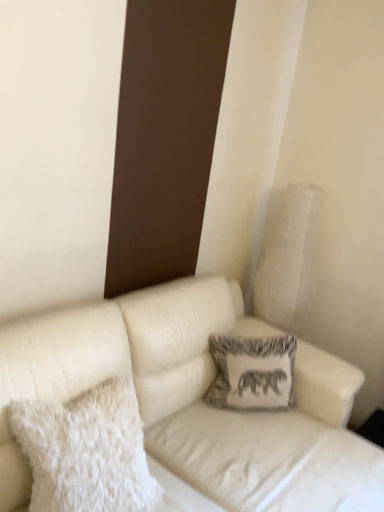
The height and width of the screenshot is (512, 384). What do you see at coordinates (252, 372) in the screenshot?
I see `printed fabric pillow at center, the second pillow from the right` at bounding box center [252, 372].

The height and width of the screenshot is (512, 384). Describe the element at coordinates (195, 400) in the screenshot. I see `white leather couch at center` at that location.

The height and width of the screenshot is (512, 384). In order to click on white leather couch at center in this screenshot , I will do `click(195, 400)`.

Locate an element on the screen. The image size is (384, 512). white textured pillow at upper right, the 3th pillow positioned from the left is located at coordinates (290, 261).

I want to click on printed fabric pillow at center, the 2th pillow positioned from the back, so click(x=252, y=372).

Is white textured pillow at upper right, acting as the 3th pillow starting from the front, facing towards white leather couch at center?

No, white textured pillow at upper right, acting as the 3th pillow starting from the front, is not oriented towards white leather couch at center.

Considering the sizes of white textured pillow at upper right, acting as the first pillow starting from the right, and white leather couch at center in the image, is white textured pillow at upper right, acting as the first pillow starting from the right, wider or thinner than white leather couch at center?

In the image, white textured pillow at upper right, acting as the first pillow starting from the right, appears to be more narrow than white leather couch at center.

From a real-world perspective, is white textured pillow at upper right, acting as the first pillow starting from the right, located higher than white leather couch at center?

Yes, from a real-world perspective, white textured pillow at upper right, acting as the first pillow starting from the right, is above white leather couch at center.

Which object is positioned more to the right, white textured pillow at upper right, the 3th pillow positioned from the left, or white leather couch at center?

Positioned to the right is white textured pillow at upper right, the 3th pillow positioned from the left.

Is white fluffy pillow at left, marked as the third pillow in a right-to-left arrangement, not inside white leather couch at center?

white fluffy pillow at left, marked as the third pillow in a right-to-left arrangement, lies outside white leather couch at center's area.

From the image's perspective, which object appears higher, white fluffy pillow at left, which is counted as the first pillow, starting from the left, or white leather couch at center?

white fluffy pillow at left, which is counted as the first pillow, starting from the left, from the image's perspective.

Between white fluffy pillow at left, which is counted as the first pillow, starting from the left, and white leather couch at center, which one has larger width?

Wider between the two is white leather couch at center.

From their relative heights in the image, would you say white fluffy pillow at left, which is counted as the first pillow, starting from the left, is taller or shorter than white leather couch at center?

white fluffy pillow at left, which is counted as the first pillow, starting from the left, is shorter than white leather couch at center.

Is printed fabric pillow at center, placed as the second pillow when sorted from left to right, wider or thinner than white fluffy pillow at left, which is the third pillow in back-to-front order?

Considering their sizes, printed fabric pillow at center, placed as the second pillow when sorted from left to right, looks slimmer than white fluffy pillow at left, which is the third pillow in back-to-front order.

From the image's perspective, is printed fabric pillow at center, placed as the second pillow when sorted from left to right, positioned above or below white fluffy pillow at left, which is counted as the first pillow, starting from the left?

Based on their image positions, printed fabric pillow at center, placed as the second pillow when sorted from left to right, is located above white fluffy pillow at left, which is counted as the first pillow, starting from the left.

Considering the relative positions of printed fabric pillow at center, placed as the second pillow when sorted from left to right, and white fluffy pillow at left, which is counted as the first pillow, starting from the left, in the image provided, is printed fabric pillow at center, placed as the second pillow when sorted from left to right, to the left or to the right of white fluffy pillow at left, which is counted as the first pillow, starting from the left,?

printed fabric pillow at center, placed as the second pillow when sorted from left to right, is positioned on white fluffy pillow at left, which is counted as the first pillow, starting from the left,'s right side.

Is white textured pillow at upper right, the 3th pillow positioned from the left, behind white fluffy pillow at left, which is the third pillow in back-to-front order?

Yes, white textured pillow at upper right, the 3th pillow positioned from the left, is further from the viewer.

Is point (276, 232) less distant than point (64, 498)?

No, it is not.

From the image's perspective, relative to white fluffy pillow at left, marked as the third pillow in a right-to-left arrangement, is white textured pillow at upper right, acting as the first pillow starting from the right, above or below?

Clearly, from the image's perspective, white textured pillow at upper right, acting as the first pillow starting from the right, is above white fluffy pillow at left, marked as the third pillow in a right-to-left arrangement.

Based on their sizes in the image, would you say white textured pillow at upper right, acting as the 3th pillow starting from the front, is bigger or smaller than white fluffy pillow at left, marked as the third pillow in a right-to-left arrangement?

In the image, white textured pillow at upper right, acting as the 3th pillow starting from the front, appears to be larger than white fluffy pillow at left, marked as the third pillow in a right-to-left arrangement.

Considering the relative sizes of white leather couch at center and printed fabric pillow at center, the 2th pillow viewed from the front, in the image provided, is white leather couch at center bigger than printed fabric pillow at center, the 2th pillow viewed from the front,?

Yes.

Does point (276, 486) lie behind point (235, 380)?

No, it is in front of (235, 380).

Is white leather couch at center at the left side of printed fabric pillow at center, placed as the second pillow when sorted from left to right?

No.

Is white leather couch at center further to camera compared to printed fabric pillow at center, the second pillow from the right?

No, white leather couch at center is in front of printed fabric pillow at center, the second pillow from the right.

Visually, is white fluffy pillow at left, which is counted as the first pillow, starting from the left, positioned to the left or to the right of printed fabric pillow at center, the 2th pillow positioned from the back?

white fluffy pillow at left, which is counted as the first pillow, starting from the left, is to the left of printed fabric pillow at center, the 2th pillow positioned from the back.

Which point is more forward, (112,493) or (247,341)?

Positioned in front is point (112,493).

Is white fluffy pillow at left, marked as the third pillow in a right-to-left arrangement, further to camera compared to printed fabric pillow at center, the second pillow from the right?

No.

From a real-world perspective, which object stands above the other?

In real-world perspective, white fluffy pillow at left, which is the third pillow in back-to-front order, is above.

Between white textured pillow at upper right, acting as the 3th pillow starting from the front, and printed fabric pillow at center, the 2th pillow viewed from the front, which one has larger width?

Wider between the two is white textured pillow at upper right, acting as the 3th pillow starting from the front.

Considering the relative sizes of white textured pillow at upper right, the 3th pillow positioned from the left, and printed fabric pillow at center, placed as the second pillow when sorted from left to right, in the image provided, is white textured pillow at upper right, the 3th pillow positioned from the left, shorter than printed fabric pillow at center, placed as the second pillow when sorted from left to right,?

Incorrect, the height of white textured pillow at upper right, the 3th pillow positioned from the left, does not fall short of that of printed fabric pillow at center, placed as the second pillow when sorted from left to right.

Is white textured pillow at upper right, acting as the 3th pillow starting from the front, smaller than printed fabric pillow at center, the second pillow from the right?

Incorrect, white textured pillow at upper right, acting as the 3th pillow starting from the front, is not smaller in size than printed fabric pillow at center, the second pillow from the right.

Locate an element on the screen. pillow that is on the right side of printed fabric pillow at center, placed as the second pillow when sorted from left to right is located at coordinates (290, 261).

Where is `studio couch that appears below the white textured pillow at upper right, the 3th pillow positioned from the left (from a real-world perspective)`? The height and width of the screenshot is (512, 384). studio couch that appears below the white textured pillow at upper right, the 3th pillow positioned from the left (from a real-world perspective) is located at coordinates (195, 400).

Identify the location of the 1st pillow positioned above the white leather couch at center (from the image's perspective). Image resolution: width=384 pixels, height=512 pixels. (87, 451).

Considering their positions, is white leather couch at center positioned closer to white textured pillow at upper right, acting as the 3th pillow starting from the front, than white fluffy pillow at left, which is counted as the first pillow, starting from the left?

Based on the image, white leather couch at center appears to be nearer to white textured pillow at upper right, acting as the 3th pillow starting from the front.

Looking at this image, considering their positions, is white textured pillow at upper right, the 1th pillow positioned from the back, positioned further to white leather couch at center than white fluffy pillow at left, which is counted as the first pillow, starting from the left?

white textured pillow at upper right, the 1th pillow positioned from the back, is positioned further to the anchor white leather couch at center.

Consider the image. When comparing their distances from white leather couch at center, does printed fabric pillow at center, the 2th pillow viewed from the front, or white textured pillow at upper right, the 3th pillow positioned from the left, seem further?

Among the two, white textured pillow at upper right, the 3th pillow positioned from the left, is located further to white leather couch at center.

Considering their positions, is white leather couch at center positioned closer to white fluffy pillow at left, marked as the third pillow in a right-to-left arrangement, than white textured pillow at upper right, acting as the first pillow starting from the right?

The object closer to white fluffy pillow at left, marked as the third pillow in a right-to-left arrangement, is white leather couch at center.

Based on their spatial positions, is white textured pillow at upper right, the 1th pillow positioned from the back, or printed fabric pillow at center, the second pillow from the right, closer to white leather couch at center?

printed fabric pillow at center, the second pillow from the right, lies closer to white leather couch at center than the other object.

From the image, which object appears to be nearer to white textured pillow at upper right, acting as the first pillow starting from the right, white fluffy pillow at left, which is counted as the first pillow, starting from the left, or white leather couch at center?

white leather couch at center is closer to white textured pillow at upper right, acting as the first pillow starting from the right.

Based on their spatial positions, is printed fabric pillow at center, placed as the second pillow when sorted from left to right, or white leather couch at center closer to white fluffy pillow at left, the first pillow positioned from the front?

white leather couch at center.

From the image, which object appears to be nearer to printed fabric pillow at center, the 2th pillow positioned from the back, white leather couch at center or white textured pillow at upper right, the 3th pillow positioned from the left?

white leather couch at center.

You are a GUI agent. You are given a task and a screenshot of the screen. Output one action in this format:
    pyautogui.click(x=<x>, y=<y>)
    Task: Click on the pillow positioned between white leather couch at center and white textured pillow at upper right, the 3th pillow positioned from the left, from near to far
    
    Given the screenshot: What is the action you would take?
    pyautogui.click(x=252, y=372)

The image size is (384, 512). I want to click on pillow between white fluffy pillow at left, which is the third pillow in back-to-front order, and white textured pillow at upper right, the 3th pillow positioned from the left, from front to back, so 252,372.

Locate an element on the screen. This screenshot has width=384, height=512. studio couch between white fluffy pillow at left, which is counted as the first pillow, starting from the left, and white textured pillow at upper right, the 3th pillow positioned from the left, from front to back is located at coordinates (195, 400).

The width and height of the screenshot is (384, 512). In order to click on studio couch between white fluffy pillow at left, marked as the third pillow in a right-to-left arrangement, and printed fabric pillow at center, the 2th pillow positioned from the back, in the front-back direction in this screenshot , I will do `click(195, 400)`.